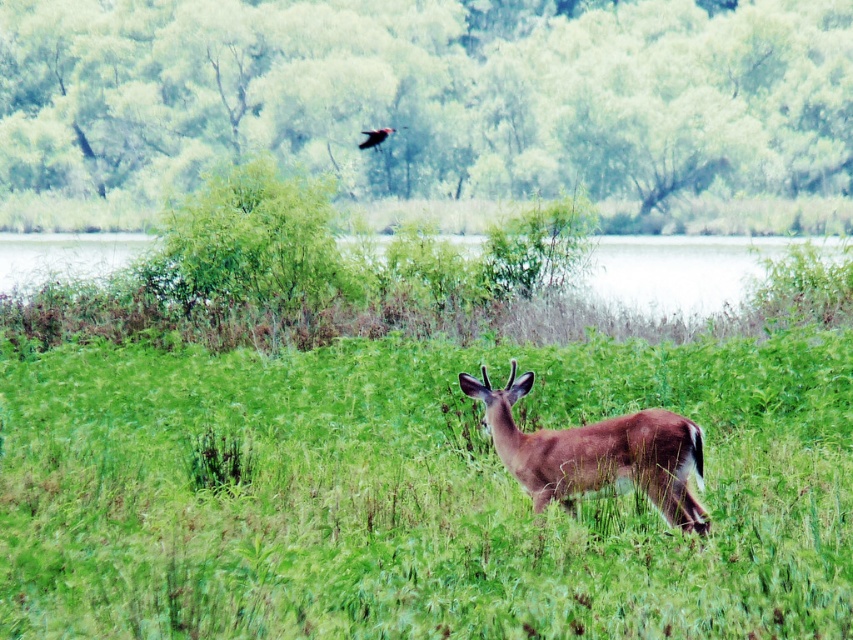
Question: Which object is positioned farthest from the green grassy lake at center?

Choices:
 (A) brown matte/deer at center
 (B) shiny black bird at upper center
 (C) green grassy at center
 (D) green leafy tree at upper center

Answer: (A)

Question: Does brown matte/deer at center come in front of shiny black bird at upper center?

Choices:
 (A) yes
 (B) no

Answer: (A)

Question: Among these points, which one is farthest from the camera?

Choices:
 (A) (57, 54)
 (B) (390, 456)

Answer: (A)

Question: Can you confirm if green grassy at center is thinner than green grassy lake at center?

Choices:
 (A) no
 (B) yes

Answer: (B)

Question: Does brown matte/deer at center appear over shiny black bird at upper center?

Choices:
 (A) yes
 (B) no

Answer: (B)

Question: Which of the following is the closest to the observer?

Choices:
 (A) green grassy lake at center
 (B) green grassy at center

Answer: (B)